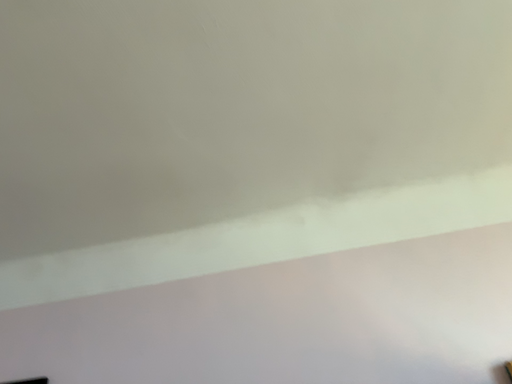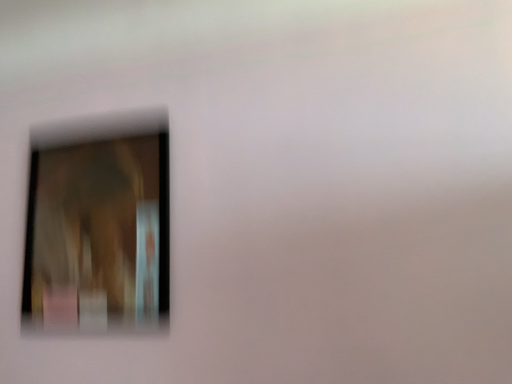
Question: Which way did the camera rotate in the video?

Choices:
 (A) rotated upward
 (B) rotated downward

Answer: (B)